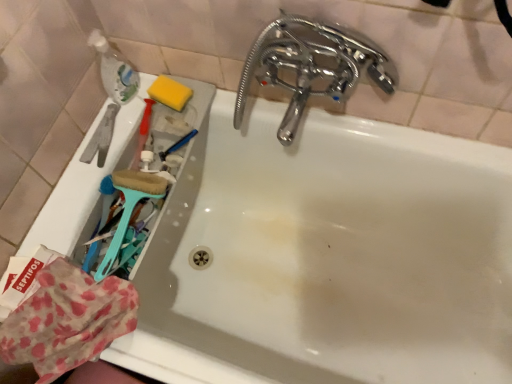
Question: Is polka dot fabric at lower left wider or thinner than chrome/metallic faucet at upper right?

Choices:
 (A) thin
 (B) wide

Answer: (B)

Question: In the image, is polka dot fabric at lower left on the left side or the right side of chrome/metallic faucet at upper right?

Choices:
 (A) left
 (B) right

Answer: (A)

Question: Which object is the farthest from the chrome/metallic faucet at upper right?

Choices:
 (A) teal plastic brush at left
 (B) translucent plastic bottle at upper left
 (C) yellow sponge at upper left
 (D) polka dot fabric at lower left

Answer: (D)

Question: Which of these objects is positioned farthest from the polka dot fabric at lower left?

Choices:
 (A) chrome/metallic faucet at upper right
 (B) yellow sponge at upper left
 (C) translucent plastic bottle at upper left
 (D) teal plastic brush at left

Answer: (A)